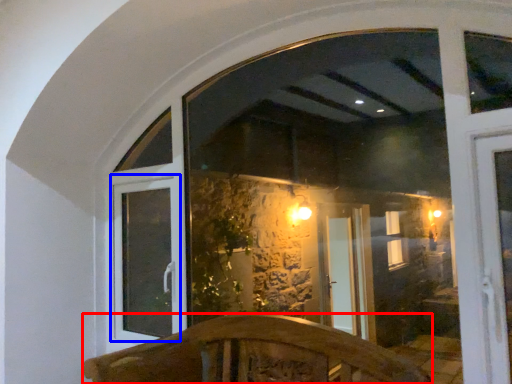
Question: Among these objects, which one is nearest to the camera, furniture (highlighted by a red box) or window frame (highlighted by a blue box)?

Choices:
 (A) furniture
 (B) window frame

Answer: (A)